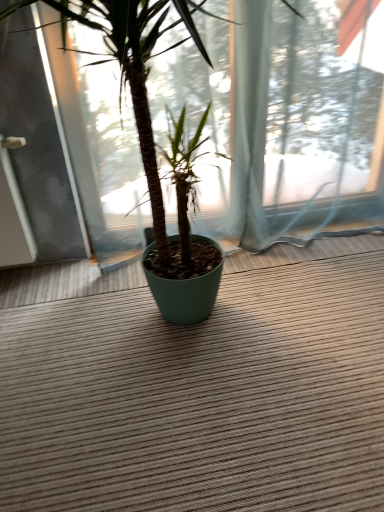
The width and height of the screenshot is (384, 512). What do you see at coordinates (136, 69) in the screenshot?
I see `green textured pot at center` at bounding box center [136, 69].

Where is `green textured pot at center`? green textured pot at center is located at coordinates (136, 69).

Identify the location of brown textured doormat at center. This screenshot has width=384, height=512. (197, 387).

What do you see at coordinates (197, 387) in the screenshot? Image resolution: width=384 pixels, height=512 pixels. I see `brown textured doormat at center` at bounding box center [197, 387].

Measure the distance between brown textured doormat at center and camera.

brown textured doormat at center is 3.75 feet from camera.

Find the location of a particular element. This screenshot has width=384, height=512. green textured pot at center is located at coordinates (136, 69).

Between green textured pot at center and brown textured doormat at center, which one appears on the left side from the viewer's perspective?

Positioned to the left is green textured pot at center.

Considering the relative positions of green textured pot at center and brown textured doormat at center in the image provided, is green textured pot at center in front of brown textured doormat at center?

Yes, the depth of green textured pot at center is less than that of brown textured doormat at center.

Which is further, [131,19] or [147,339]?

Point [147,339]

From the image's perspective, is green textured pot at center above or below brown textured doormat at center?

From the image's perspective, green textured pot at center appears above brown textured doormat at center.

In the scene shown: From a real-world perspective, which is physically above, green textured pot at center or brown textured doormat at center?

green textured pot at center.

Which object is thinner, green textured pot at center or brown textured doormat at center?

green textured pot at center is thinner.

Is green textured pot at center shorter than brown textured doormat at center?

In fact, green textured pot at center may be taller than brown textured doormat at center.

Does green textured pot at center have a larger size compared to brown textured doormat at center?

Indeed, green textured pot at center has a larger size compared to brown textured doormat at center.

Which is correct: green textured pot at center is inside brown textured doormat at center, or outside of it?

green textured pot at center lies outside brown textured doormat at center.

Is green textured pot at center placed right next to brown textured doormat at center?

There is a gap between green textured pot at center and brown textured doormat at center.

Could you tell me if green textured pot at center is turned towards brown textured doormat at center?

No, green textured pot at center is not oriented towards brown textured doormat at center.

How many degrees apart are the facing directions of green textured pot at center and brown textured doormat at center?

There is a 5.44-degree angle between the facing directions of green textured pot at center and brown textured doormat at center.

At what (x,y) coordinates should I click in order to perform the action: click on doormat below the green textured pot at center (from a real-world perspective). Please return your answer as a coordinate pair (x, y). This screenshot has height=512, width=384. Looking at the image, I should click on (197, 387).

Which is more to the right, brown textured doormat at center or green textured pot at center?

brown textured doormat at center.

Is brown textured doormat at center positioned in front of green textured pot at center?

No.

Is point (215, 414) more distant than point (155, 282)?

No, it is in front of (155, 282).

Looking at this image, from the image's perspective, between brown textured doormat at center and green textured pot at center, who is located below?

brown textured doormat at center is shown below in the image.

From a real-world perspective, which is physically below, brown textured doormat at center or green textured pot at center?

brown textured doormat at center is physically lower.

Considering the sizes of objects brown textured doormat at center and green textured pot at center in the image provided, who is wider, brown textured doormat at center or green textured pot at center?

brown textured doormat at center is wider.

Does brown textured doormat at center have a lesser height compared to green textured pot at center?

Yes, brown textured doormat at center is shorter than green textured pot at center.

In terms of size, does brown textured doormat at center appear bigger or smaller than green textured pot at center?

brown textured doormat at center is smaller than green textured pot at center.

Is brown textured doormat at center positioned beyond the bounds of green textured pot at center?

That's correct, brown textured doormat at center is outside of green textured pot at center.

Is there a large distance between brown textured doormat at center and green textured pot at center?

No, there isn't a large distance between brown textured doormat at center and green textured pot at center.

Could you tell me if brown textured doormat at center is turned towards green textured pot at center?

Yes, brown textured doormat at center is oriented towards green textured pot at center.

How different are the orientations of brown textured doormat at center and green textured pot at center in degrees?

5.44 degrees separate the facing orientations of brown textured doormat at center and green textured pot at center.

The image size is (384, 512). I want to click on doormat on the right side of green textured pot at center, so click(x=197, y=387).

Where is `houseplant in front of the brown textured doormat at center`? The height and width of the screenshot is (512, 384). houseplant in front of the brown textured doormat at center is located at coordinates (136, 69).

In the image, there is a green textured pot at center. At what (x,y) coordinates should I click in order to perform the action: click on doormat below it (from a real-world perspective). Please return your answer as a coordinate pair (x, y). The width and height of the screenshot is (384, 512). Looking at the image, I should click on (197, 387).